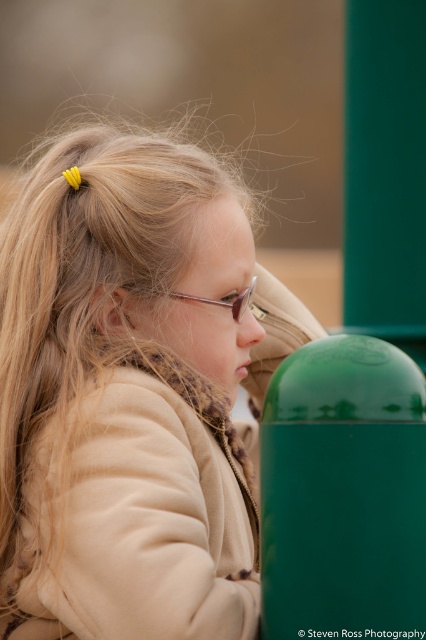
Question: Is matte beige coat at center smaller than pink translucent goggles at center?

Choices:
 (A) yes
 (B) no

Answer: (B)

Question: Which object is closer to the camera taking this photo?

Choices:
 (A) matte beige coat at center
 (B) pink translucent goggles at center

Answer: (A)

Question: Which object appears farthest from the camera in this image?

Choices:
 (A) matte beige coat at center
 (B) pink translucent goggles at center

Answer: (B)

Question: Is matte beige coat at center thinner than pink translucent goggles at center?

Choices:
 (A) no
 (B) yes

Answer: (A)

Question: Which of the following is the farthest from the observer?

Choices:
 (A) matte beige coat at center
 (B) pink translucent goggles at center

Answer: (B)

Question: In this image, where is matte beige coat at center located relative to pink translucent goggles at center?

Choices:
 (A) left
 (B) right

Answer: (A)